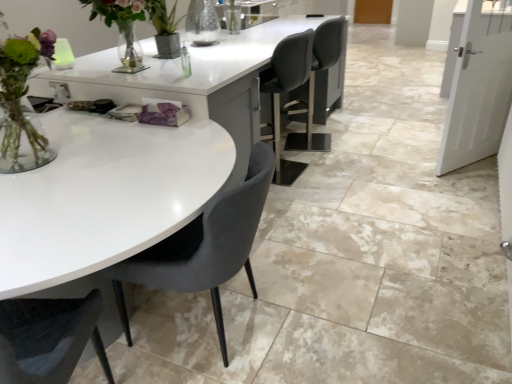
Question: From the image's perspective, would you say velvet grey chair at center is shown under white glossy table at center?

Choices:
 (A) yes
 (B) no

Answer: (A)

Question: Would you say velvet grey chair at center is outside white glossy table at center?

Choices:
 (A) yes
 (B) no

Answer: (A)

Question: Could you tell me if velvet grey chair at center is turned towards white glossy table at center?

Choices:
 (A) no
 (B) yes

Answer: (A)

Question: Does velvet grey chair at center touch white glossy table at center?

Choices:
 (A) yes
 (B) no

Answer: (B)

Question: Does velvet grey chair at center have a greater width compared to white glossy table at center?

Choices:
 (A) no
 (B) yes

Answer: (A)

Question: Is velvet grey chair at center positioned behind white glossy table at center?

Choices:
 (A) no
 (B) yes

Answer: (B)

Question: Is white glossy table at center at the right side of velvet grey chair at center?

Choices:
 (A) yes
 (B) no

Answer: (A)

Question: Considering the relative sizes of white glossy table at center and velvet grey chair at center in the image provided, is white glossy table at center taller than velvet grey chair at center?

Choices:
 (A) no
 (B) yes

Answer: (A)

Question: Is white glossy table at center positioned behind velvet grey chair at center?

Choices:
 (A) no
 (B) yes

Answer: (A)

Question: Would you consider white glossy table at center to be distant from velvet grey chair at center?

Choices:
 (A) yes
 (B) no

Answer: (B)

Question: From a real-world perspective, is white glossy table at center beneath velvet grey chair at center?

Choices:
 (A) yes
 (B) no

Answer: (A)

Question: Does white glossy table at center have a larger size compared to velvet grey chair at center?

Choices:
 (A) no
 (B) yes

Answer: (B)

Question: From their relative heights in the image, would you say velvet grey chair at center is taller or shorter than white glossy table at center?

Choices:
 (A) tall
 (B) short

Answer: (A)